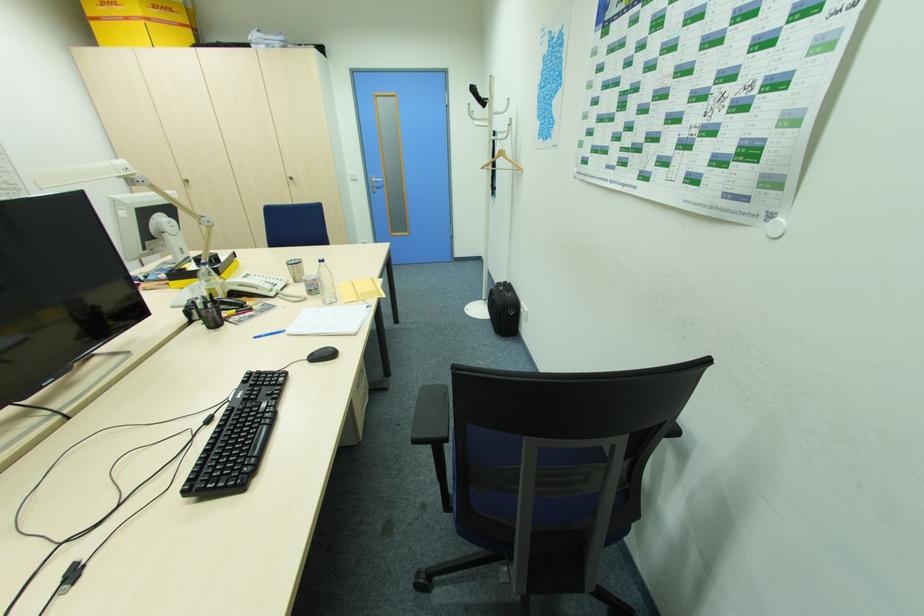
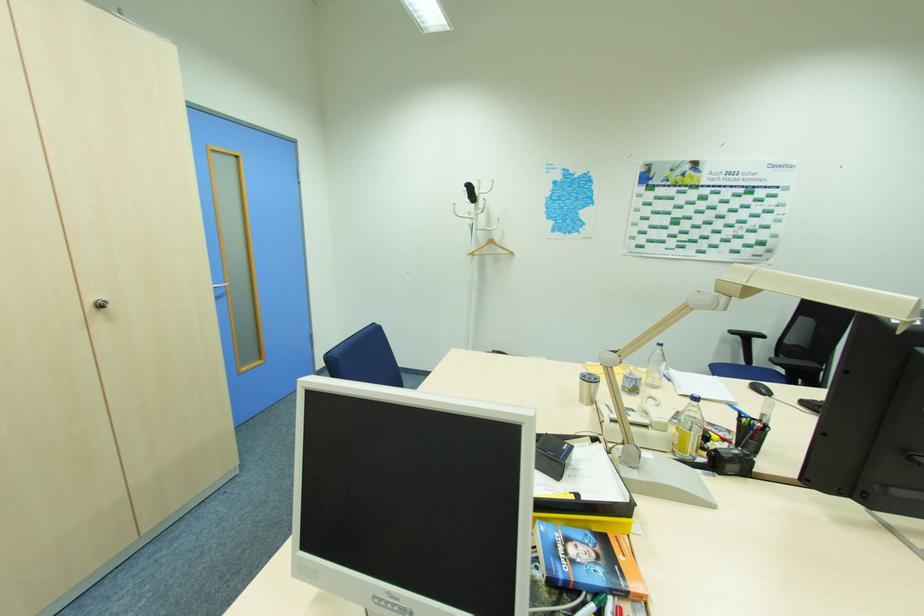
Find the pixel in the second image that matches the point at 490,99 in the first image.

(479, 197)